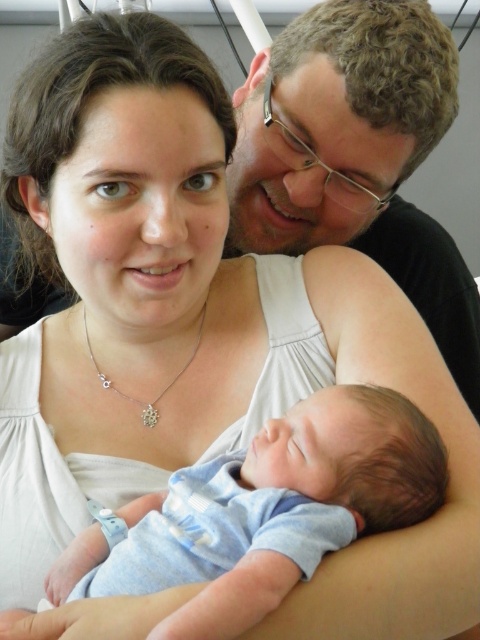
Question: Is blue soft fabric newborn at center closer to the viewer compared to silver/glass necklace at center?

Choices:
 (A) no
 (B) yes

Answer: (B)

Question: Which point is farther from the camera taking this photo?

Choices:
 (A) (250, 524)
 (B) (112, 385)

Answer: (B)

Question: Does blue soft fabric newborn at center lie in front of silver/glass necklace at center?

Choices:
 (A) no
 (B) yes

Answer: (B)

Question: Observing the image, what is the correct spatial positioning of blue soft fabric newborn at center in reference to silver/glass necklace at center?

Choices:
 (A) above
 (B) below

Answer: (B)

Question: Which point is closer to the camera?

Choices:
 (A) silver/glass necklace at center
 (B) blue soft fabric newborn at center

Answer: (B)